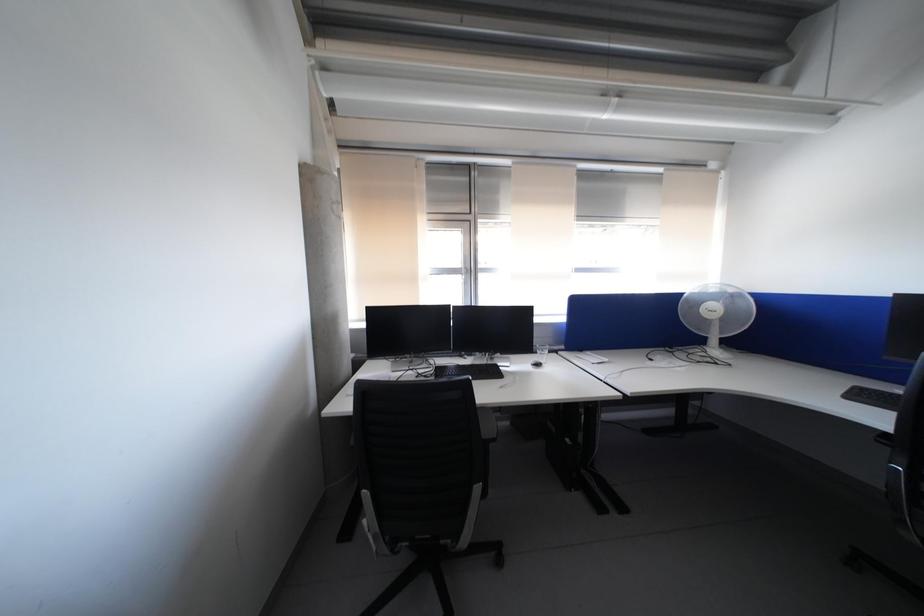
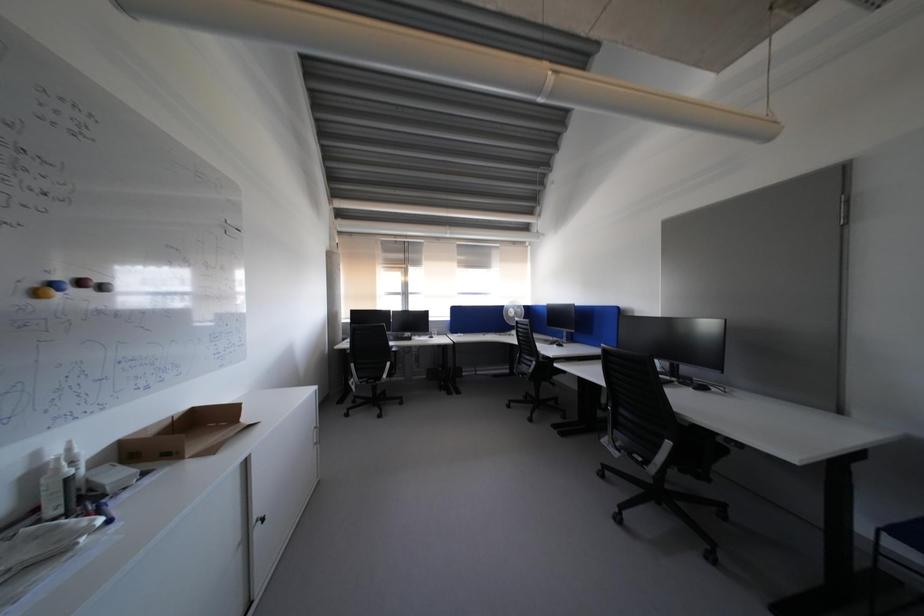
Question: Which direction would the cameraman need to move to produce the second image? Reply with the corresponding letter.

Choices:
 (A) Left
 (B) Right
 (C) Forward
 (D) Backward

Answer: (D)